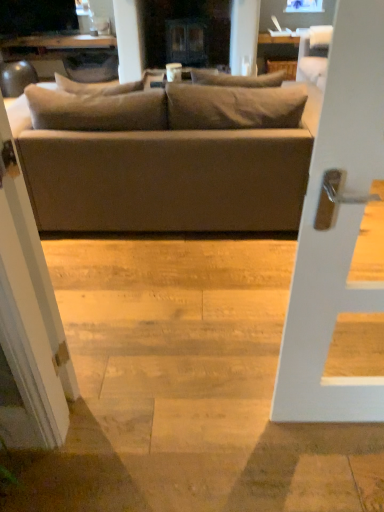
Question: Is matte black tv at upper left situated inside matte gray couch at center or outside?

Choices:
 (A) inside
 (B) outside

Answer: (B)

Question: Relative to matte gray couch at center, is matte black tv at upper left in front or behind?

Choices:
 (A) front
 (B) behind

Answer: (B)

Question: Which object is the farthest from the matte black tv at upper left?

Choices:
 (A) matte gray couch at center
 (B) white glossy screen door at left
 (C) white matte door handle at center

Answer: (C)

Question: Considering the real-world distances, which object is farthest from the matte black tv at upper left?

Choices:
 (A) white glossy screen door at left
 (B) white matte door handle at center
 (C) matte gray couch at center

Answer: (B)